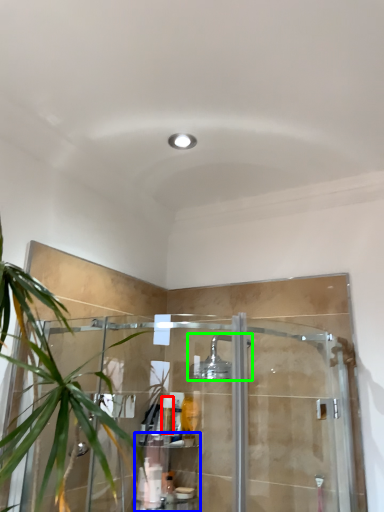
Question: Which object is the farthest from toiletry (highlighted by a red box)? Choose among these: shelf (highlighted by a blue box) or shower (highlighted by a green box).

Choices:
 (A) shelf
 (B) shower

Answer: (B)